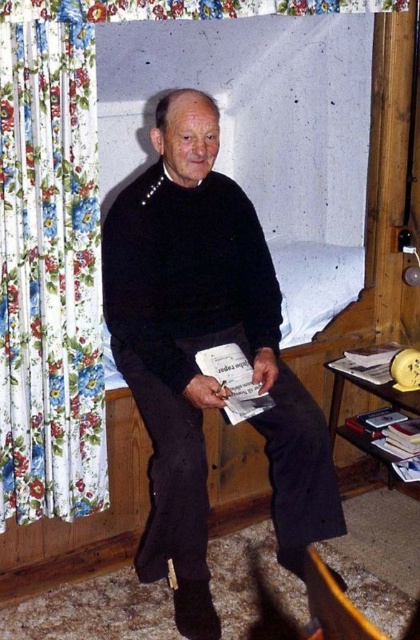
Question: Which point appears farthest from the camera in this image?

Choices:
 (A) (259, 388)
 (B) (354, 636)
 (C) (189, 451)

Answer: (A)

Question: Which of the following is the closest to the observer?

Choices:
 (A) (307, 588)
 (B) (50, 342)

Answer: (A)

Question: Can you confirm if floral fabric curtain at left is positioned below orange fabric armchair at lower right?

Choices:
 (A) yes
 (B) no

Answer: (B)

Question: Does orange fabric armchair at lower right come in front of white paper book at center?

Choices:
 (A) no
 (B) yes

Answer: (B)

Question: Which of the following is the closest to the observer?

Choices:
 (A) (254, 404)
 (B) (309, 552)
 (C) (184, 227)

Answer: (B)

Question: Does black matte sweater at center come in front of orange fabric armchair at lower right?

Choices:
 (A) no
 (B) yes

Answer: (A)